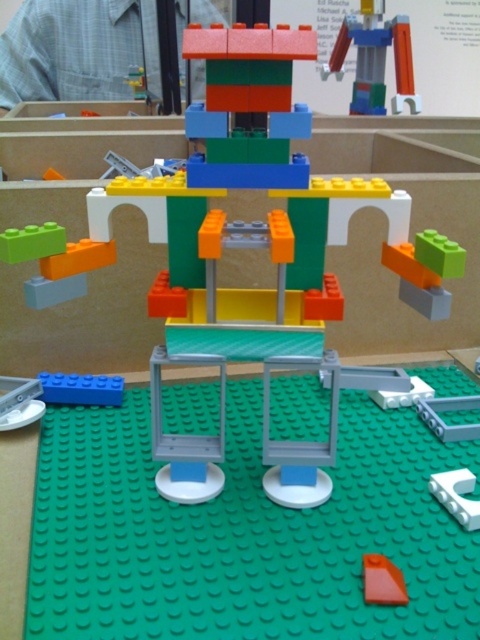
Question: Which point is farther from the camera taking this photo?

Choices:
 (A) (40, 92)
 (B) (113, 392)
 (C) (471, 472)

Answer: (A)

Question: Among these points, which one is nearest to the camera?

Choices:
 (A) (57, 387)
 (B) (463, 484)
 (C) (47, 6)
 (D) (351, 17)

Answer: (B)

Question: Can you confirm if white matte plastic plate at lower right is positioned to the left of orange matte triangle at center?

Choices:
 (A) no
 (B) yes

Answer: (A)

Question: Which point is closer to the camera?

Choices:
 (A) white matte plastic plate at lower right
 (B) brushed metal man at upper left
 (C) blue matte block at lower left
 (D) orange matte triangle at center

Answer: (D)

Question: Is white matte plastic plate at lower right to the left of orange matte triangle at center from the viewer's perspective?

Choices:
 (A) no
 (B) yes

Answer: (A)

Question: Is translucent blue plastic robot at upper center smaller than blue matte block at lower left?

Choices:
 (A) no
 (B) yes

Answer: (A)